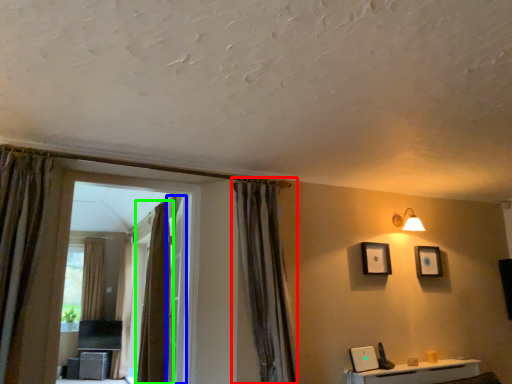
Question: Which object is the farthest from curtain (highlighted by a red box)? Choose among these: screen door (highlighted by a blue box) or curtain (highlighted by a green box).

Choices:
 (A) screen door
 (B) curtain

Answer: (B)